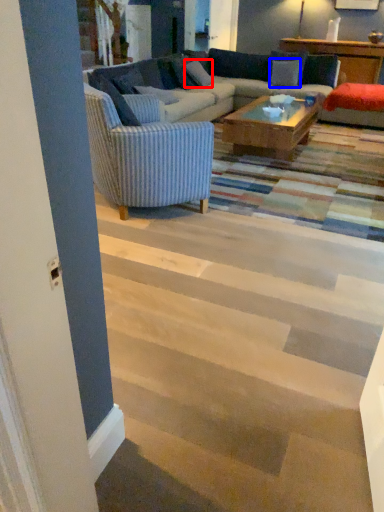
Question: Which object appears farthest to the camera in this image, pillow (highlighted by a red box) or pillow (highlighted by a blue box)?

Choices:
 (A) pillow
 (B) pillow

Answer: (B)